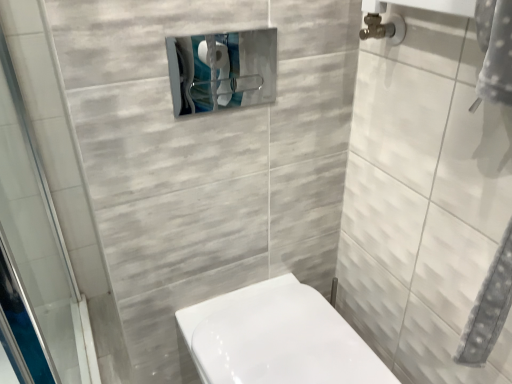
This screenshot has width=512, height=384. In order to click on white glossy toilet at lower center in this screenshot , I will do `click(277, 338)`.

The height and width of the screenshot is (384, 512). What do you see at coordinates (277, 338) in the screenshot? I see `white glossy toilet at lower center` at bounding box center [277, 338].

Find the location of `white glossy toilet at lower center`. white glossy toilet at lower center is located at coordinates coord(277,338).